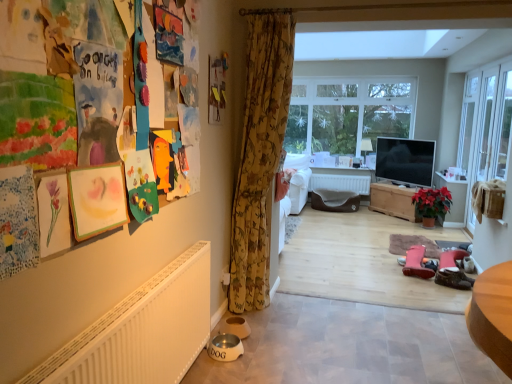
Question: Is brown leather shoes at lower right taller or shorter than clear glass screen door at right?

Choices:
 (A) tall
 (B) short

Answer: (B)

Question: From the image's perspective, is brown leather shoes at lower right positioned above or below clear glass screen door at right?

Choices:
 (A) above
 (B) below

Answer: (B)

Question: Which of these objects is positioned closest to the white matte radiator at lower left?

Choices:
 (A) wooden chest at center
 (B) green matte poinsettia at center-right
 (C) clear glass window at center
 (D) floral fabric curtain at center
 (E) brown leather shoes at lower right

Answer: (A)

Question: Based on their relative distances, which object is farther from the brown leather shoes at lower right?

Choices:
 (A) floral fabric curtain at center
 (B) clear glass screen door at right
 (C) white matte radiator at lower left
 (D) green matte poinsettia at center-right
 (E) clear glass window at center

Answer: (E)